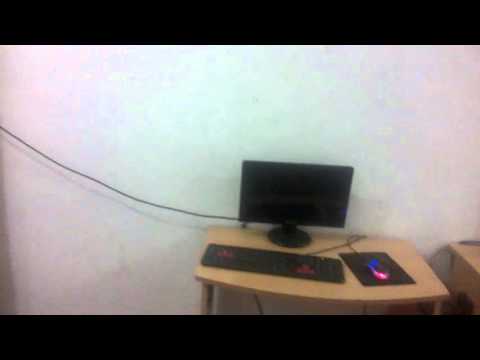
The height and width of the screenshot is (360, 480). Find the location of `computer stand`. computer stand is located at coordinates (291, 232).